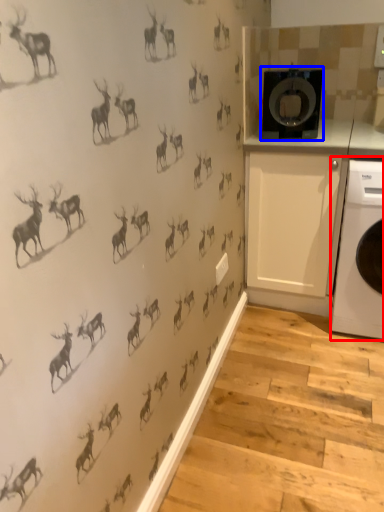
Question: Among these objects, which one is farthest to the camera, home appliance (highlighted by a red box) or washing machine (highlighted by a blue box)?

Choices:
 (A) home appliance
 (B) washing machine

Answer: (B)